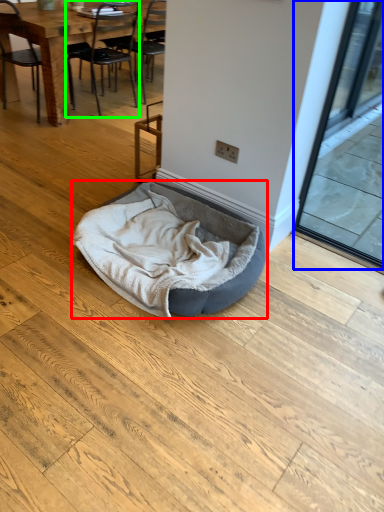
Question: Estimate the real-world distances between objects in this image. Which object is closer to dog bed (highlighted by a red box), screen door (highlighted by a blue box) or chair (highlighted by a green box)?

Choices:
 (A) screen door
 (B) chair

Answer: (A)